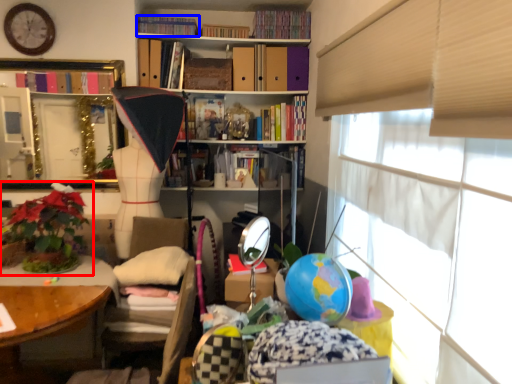
Question: Which object appears closest to the camera in this image, houseplant (highlighted by a red box) or book (highlighted by a blue box)?

Choices:
 (A) houseplant
 (B) book

Answer: (A)